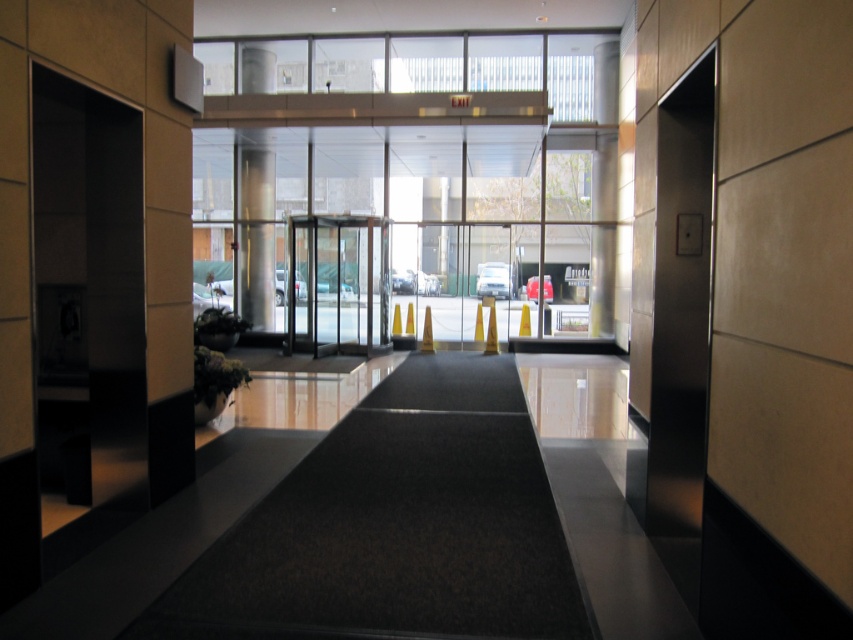
Question: Where is transparent glass door at center located in relation to metallic column at center in the image?

Choices:
 (A) right
 (B) left

Answer: (A)

Question: Does transparent glass door at center appear on the right side of metallic column at center?

Choices:
 (A) yes
 (B) no

Answer: (A)

Question: Which point is closer to the camera taking this photo?

Choices:
 (A) pos(254,156)
 (B) pos(311,252)

Answer: (B)

Question: Does transparent glass door at center appear under metallic column at center?

Choices:
 (A) no
 (B) yes

Answer: (B)

Question: Which of the following is the farthest from the observer?

Choices:
 (A) metallic column at center
 (B) transparent glass door at center

Answer: (B)